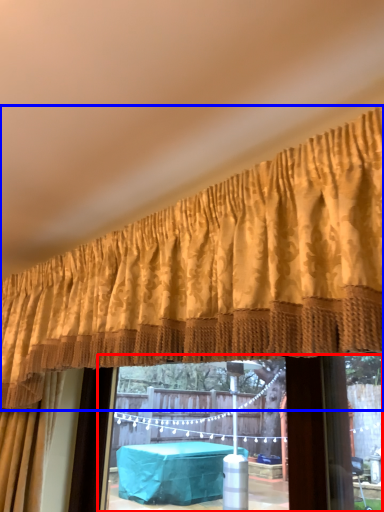
Question: Which point is closer to the camera, window frame (highlighted by a red box) or curtain (highlighted by a blue box)?

Choices:
 (A) window frame
 (B) curtain

Answer: (B)